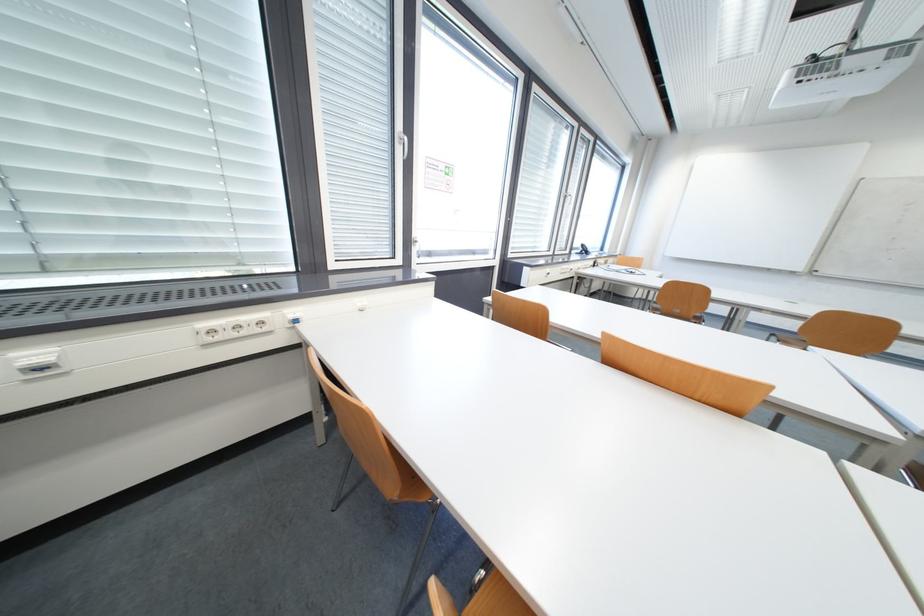
What do you see at coordinates (403, 144) in the screenshot?
I see `the white window handle` at bounding box center [403, 144].